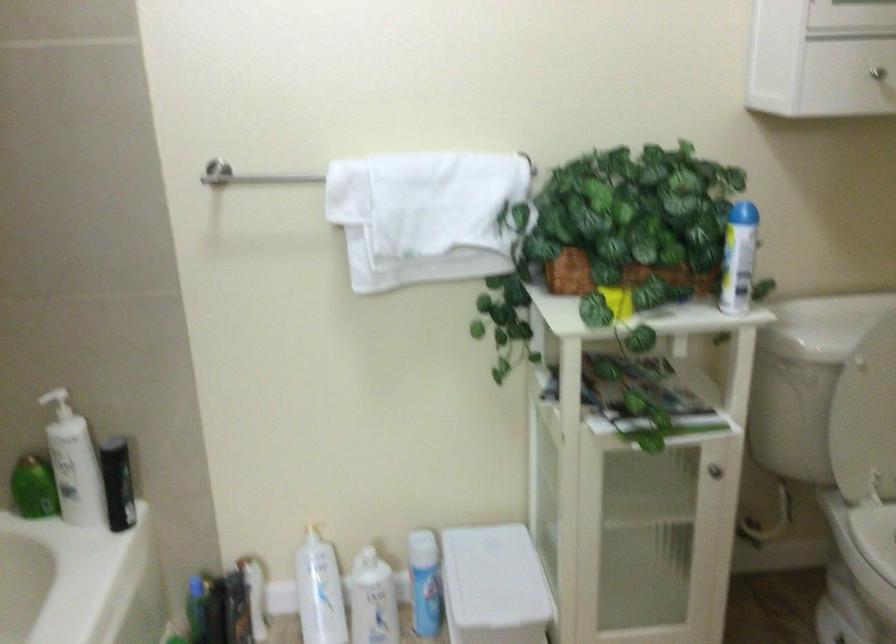
Locate an element on the screen. The width and height of the screenshot is (896, 644). black plastic bottle is located at coordinates (117, 483).